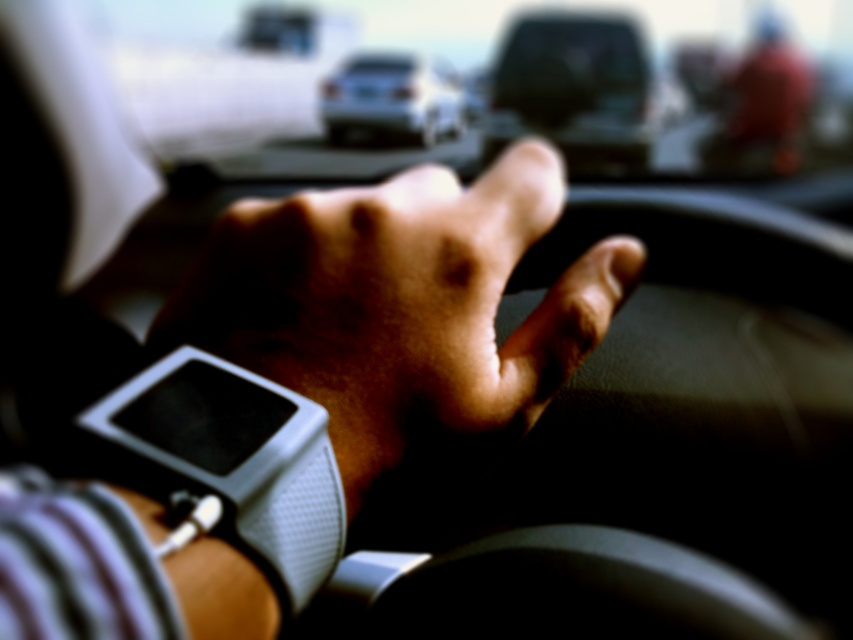
Looking at this image, does white matte watch at center have a greater height compared to silver metallic sedan at center?

No, white matte watch at center is not taller than silver metallic sedan at center.

Between point (461, 234) and point (418, 140), which one is positioned behind?

Positioned behind is point (418, 140).

At what (x,y) coordinates should I click in order to perform the action: click on white matte watch at center. Please return your answer as a coordinate pair (x, y). The image size is (853, 640). Looking at the image, I should click on (402, 310).